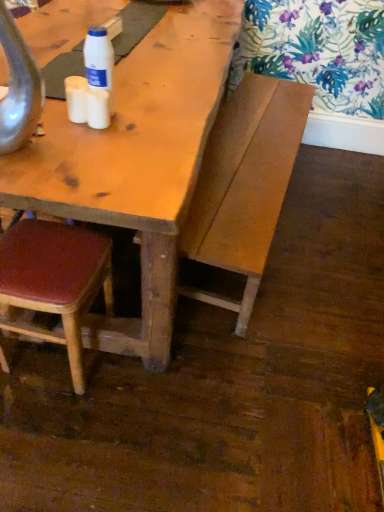
Question: From their relative heights in the image, would you say wooden bench at center is taller or shorter than leatherette chair at lower left?

Choices:
 (A) tall
 (B) short

Answer: (A)

Question: Relative to leatherette chair at lower left, is wooden bench at center in front or behind?

Choices:
 (A) front
 (B) behind

Answer: (B)

Question: Which is farther from the white matte cup at center, arranged as the second coffee cup when viewed from the right?

Choices:
 (A) white plastic bottle at upper center
 (B) white matte coffee cup at upper left, arranged as the 1th coffee cup when viewed from the right
 (C) wooden bench at center
 (D) leatherette chair at lower left

Answer: (C)

Question: Which of these objects is positioned closest to the white matte cup at center, placed as the first coffee cup when sorted from left to right?

Choices:
 (A) white matte coffee cup at upper left, arranged as the 1th coffee cup when viewed from the right
 (B) wooden bench at center
 (C) leatherette chair at lower left
 (D) white plastic bottle at upper center

Answer: (A)